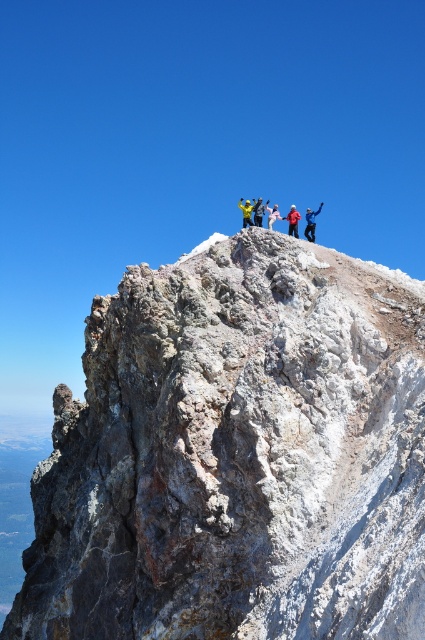
You are a photographer planning to take a group photo of the climbers. You want to ensure that all climbers are visible in the photo. Given the positions of the matte yellow jacket at center and the yellow fabric jacket at upper center, which jacket should you position closer to the camera to avoid blocking the view of the other?

You should position the matte yellow jacket at center closer to the camera because the yellow fabric jacket at upper center is behind it, so moving the matte yellow jacket forward will prevent it from blocking the view of the jacket behind.

You are a drone operator tasked with capturing aerial footage of the climbers on the mountain peak. The drone needs to hover directly above the matte yellow jacket at center to get the best shot. Given the coordinates provided, can you confirm the exact position where the drone should hover?

The matte yellow jacket at center is located at point (292, 221), so the drone should hover directly above that coordinate to capture the best shot.